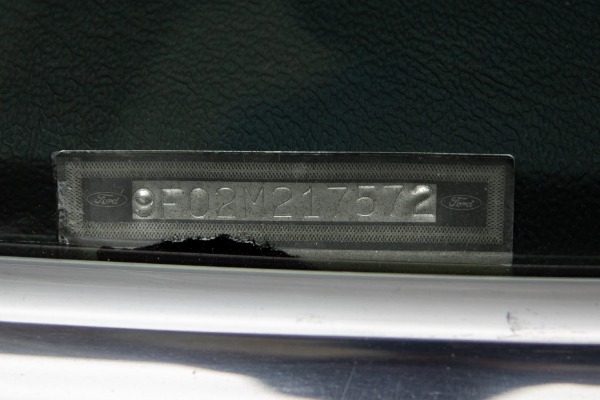
You are a GUI agent. You are given a task and a screenshot of the screen. Output one action in this format:
    pyautogui.click(x=<x>, y=<y>)
    Task: Click on the silver plate
    Image resolution: width=600 pixels, height=400 pixels.
    Given the screenshot: What is the action you would take?
    pyautogui.click(x=373, y=215)